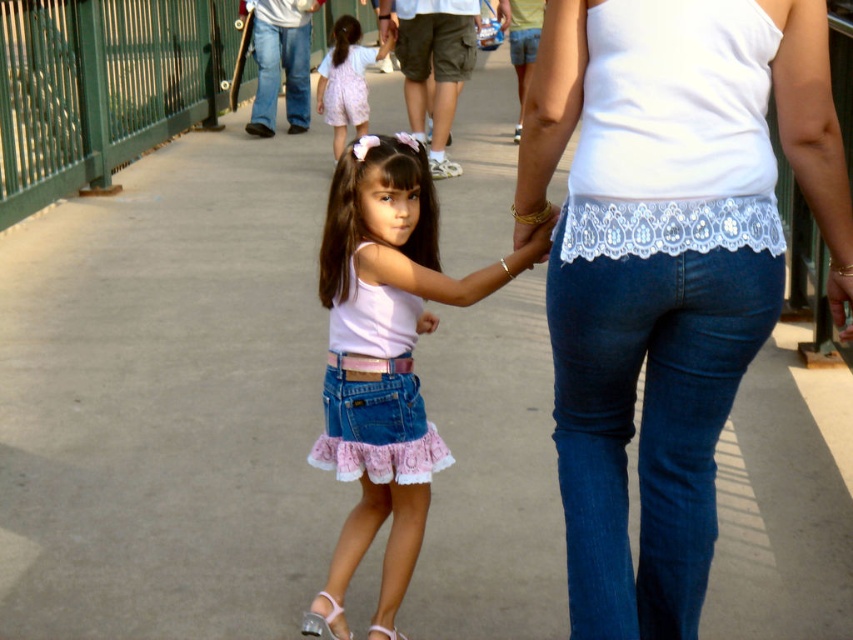
You are a fashion designer observing the scene and want to create a new outfit. Given that the pink denim skirt at center is narrower than the pink lace dress at center, which item would allow for more movement while walking?

The pink lace dress at center would allow for more movement while walking since it is wider than the pink denim skirt at center.

You are a photographer standing on the walkway and notice the clear plastic sandal at lower center and the white leather sandal at lower center. Which sandal is located to the left of the other?

The clear plastic sandal at lower center is positioned on the left side of white leather sandal at lower center.

Based on the scene description, where exactly is the denim jeans at center located in the image?

The denim jeans at center is located at point [666,269].